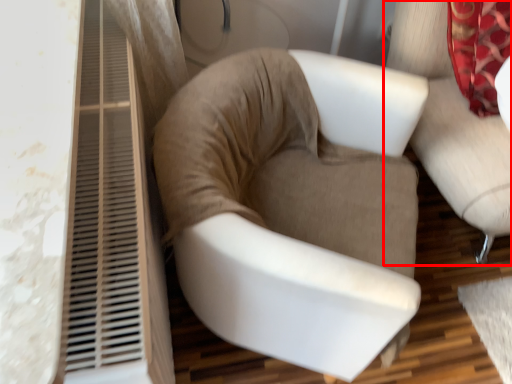
Question: From the image's perspective, where is chair (annotated by the red box) located in relation to chair in the image?

Choices:
 (A) below
 (B) above

Answer: (B)